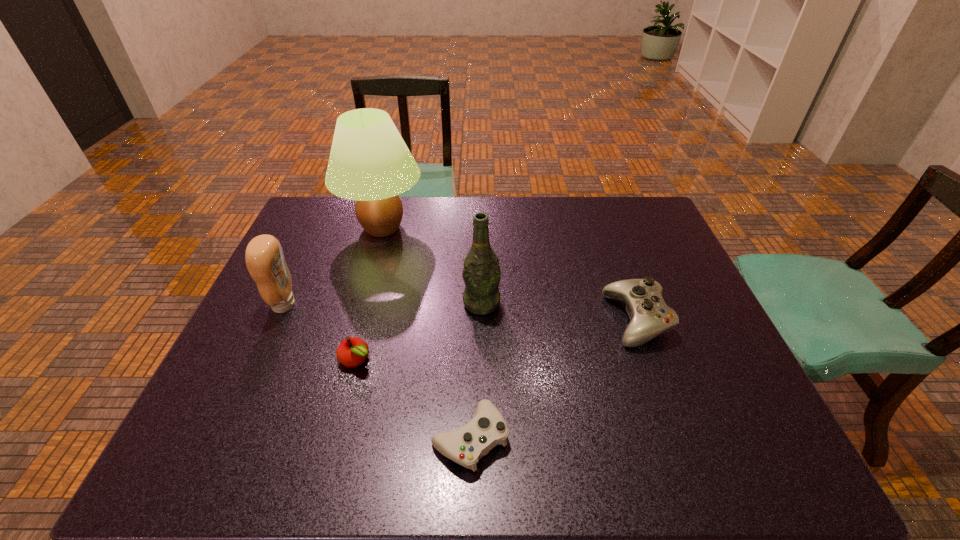
You are a GUI agent. You are given a task and a screenshot of the screen. Output one action in this format:
    pyautogui.click(x=<x>, y=<y>)
    Task: Click on the vacant space that satisfies the following two spatial constraints: 1. on the shade of the farthest object; 2. on the right side of the rightmost object
    
    Given the screenshot: What is the action you would take?
    pyautogui.click(x=357, y=320)

Where is `free location that satisfies the following two spatial constraints: 1. on the label of the third tallest object; 2. on the back side of the apple`? The width and height of the screenshot is (960, 540). free location that satisfies the following two spatial constraints: 1. on the label of the third tallest object; 2. on the back side of the apple is located at coordinates (259, 359).

At what (x,y) coordinates should I click in order to perform the action: click on vacant area that satisfies the following two spatial constraints: 1. on the shade of the nearest object; 2. on the right side of the lampshade. Please return your answer as a coordinate pair (x, y). This screenshot has height=540, width=960. Looking at the image, I should click on (324, 437).

At what (x,y) coordinates should I click in order to perform the action: click on vacant region that satisfies the following two spatial constraints: 1. on the shade of the farther control; 2. on the right side of the farthest object. Please return your answer as a coordinate pair (x, y). Looking at the image, I should click on (357, 320).

Find the location of a particular element. The height and width of the screenshot is (540, 960). free region that satisfies the following two spatial constraints: 1. on the surface of the rightmost object; 2. on the right side of the second tallest object is located at coordinates (482, 320).

In order to click on vacant point that satisfies the following two spatial constraints: 1. on the shade of the nearest object; 2. on the right side of the tallest object in this screenshot , I will do `click(324, 437)`.

In order to click on vacant space that satisfies the following two spatial constraints: 1. on the front side of the apple; 2. on the left side of the shorter control in this screenshot , I will do `click(336, 437)`.

You are a GUI agent. You are given a task and a screenshot of the screen. Output one action in this format:
    pyautogui.click(x=<x>, y=<y>)
    Task: Click on the free region that satisfies the following two spatial constraints: 1. on the back side of the right control; 2. on the left side of the shortest object
    
    Given the screenshot: What is the action you would take?
    pyautogui.click(x=472, y=320)

Find the location of a particular element. vacant space that satisfies the following two spatial constraints: 1. on the back side of the shorter control; 2. on the left side of the right control is located at coordinates (472, 320).

You are a GUI agent. You are given a task and a screenshot of the screen. Output one action in this format:
    pyautogui.click(x=<x>, y=<y>)
    Task: Click on the free space that satisfies the following two spatial constraints: 1. on the label of the condiment; 2. on the right side of the apple
    The image size is (960, 540).
    Given the screenshot: What is the action you would take?
    pyautogui.click(x=259, y=359)